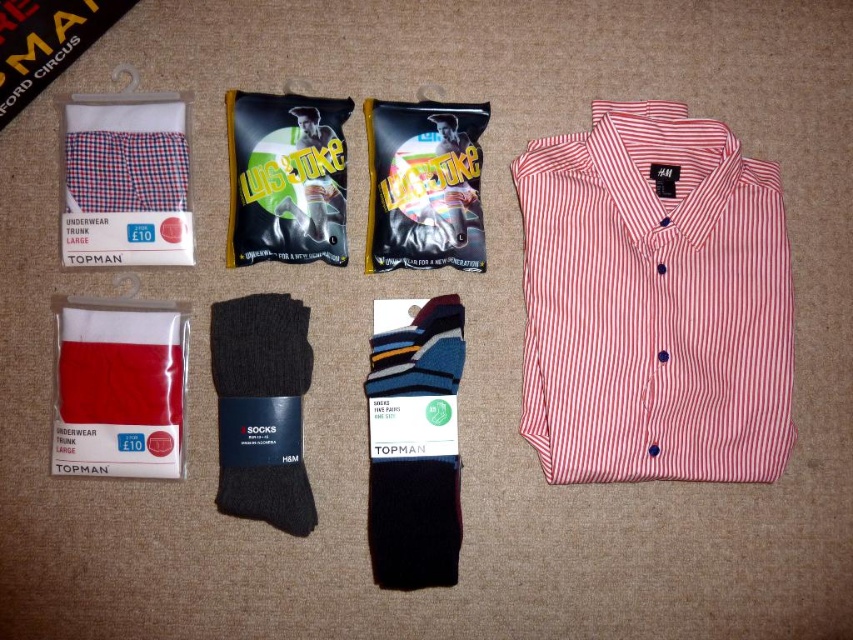
You are organizing a clothing store and need to place the checkered fabric underwear trunk at upper left. According to the layout, where should you position it relative to the other items?

The checkered fabric underwear trunk at upper left is located at point (125,182), so you should position it at that coordinate relative to the other items.